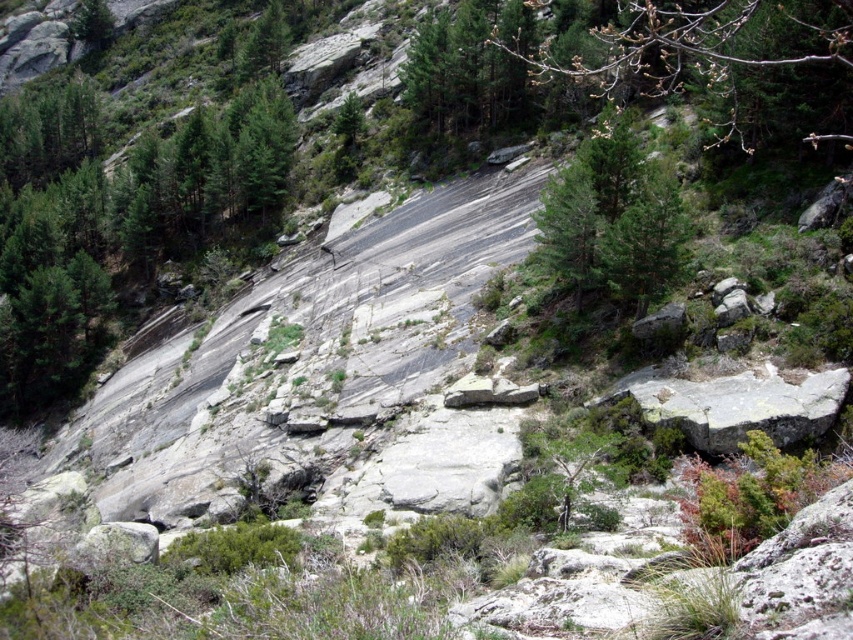
Question: Which point is farther to the camera?

Choices:
 (A) bare branches at upper center
 (B) green matte tree at center

Answer: (B)

Question: Is the position of bare branches at upper center less distant than that of green matte tree at center?

Choices:
 (A) yes
 (B) no

Answer: (A)

Question: Among these objects, which one is nearest to the camera?

Choices:
 (A) bare branches at upper center
 (B) green matte tree at center

Answer: (A)

Question: Is the position of bare branches at upper center less distant than that of green matte tree at center?

Choices:
 (A) yes
 (B) no

Answer: (A)

Question: Which point appears closest to the camera in this image?

Choices:
 (A) (664, 81)
 (B) (624, 184)

Answer: (B)

Question: Is bare branches at upper center above green matte tree at center?

Choices:
 (A) yes
 (B) no

Answer: (A)